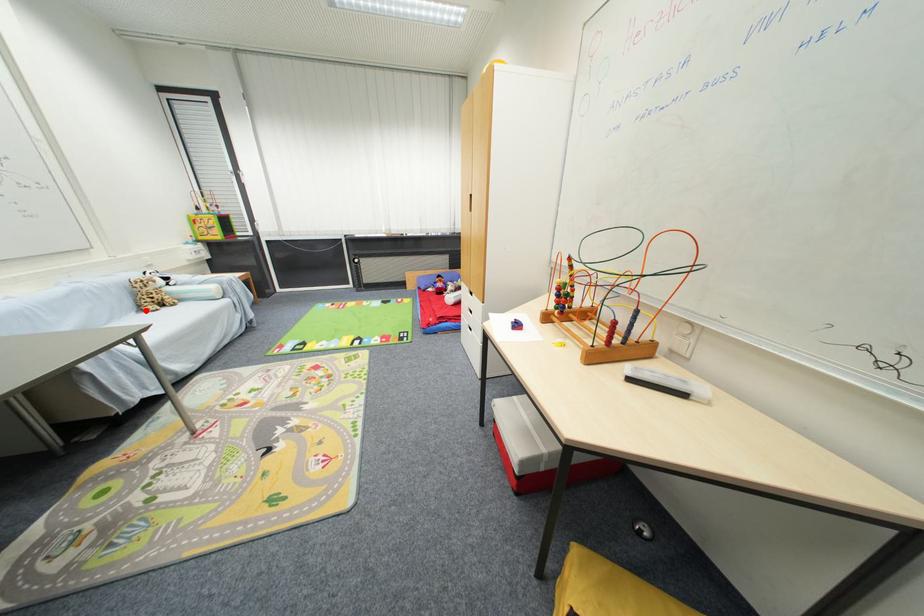
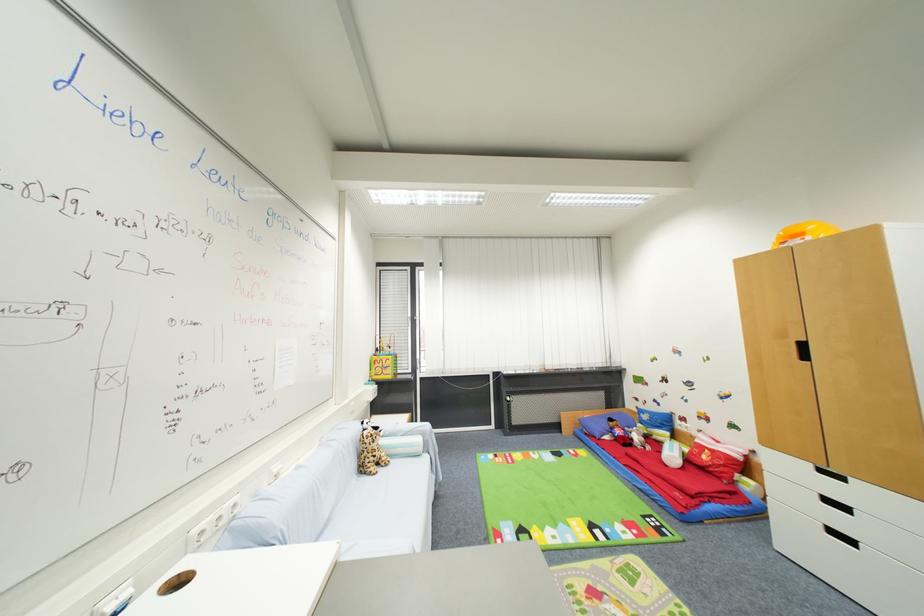
Question: I am providing you with two images of the same scene from different viewpoints. A red point is shown in image1. For the corresponding object point in image2, is it positioned nearer or farther from the camera?

Choices:
 (A) Nearer
 (B) Farther

Answer: (B)